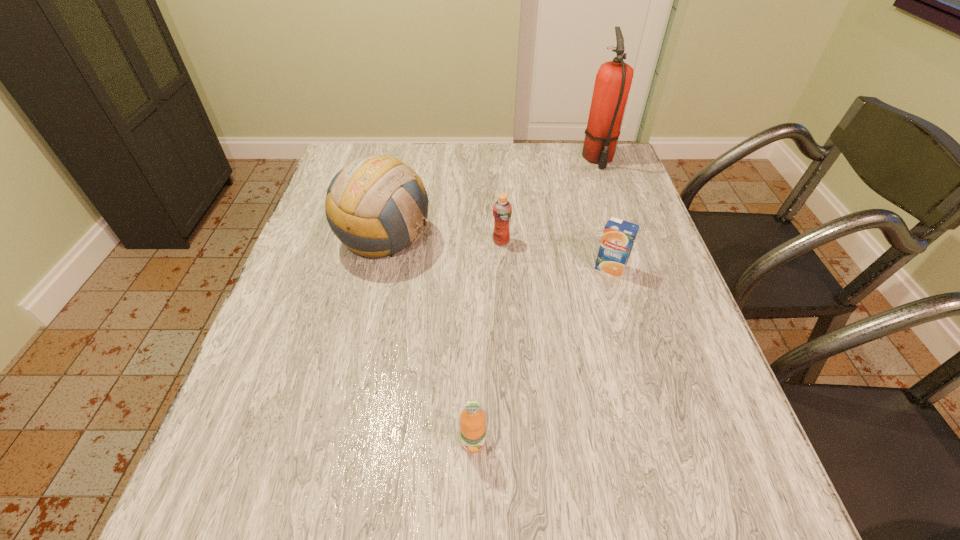
Locate which orange juice ranks third in proximity to the leftmost object. Please provide its 2D coordinates. Your answer should be formatted as a tuple, i.e. [(x, y)], where the tuple contains the x and y coordinates of a point satisfying the conditions above.

[(472, 418)]